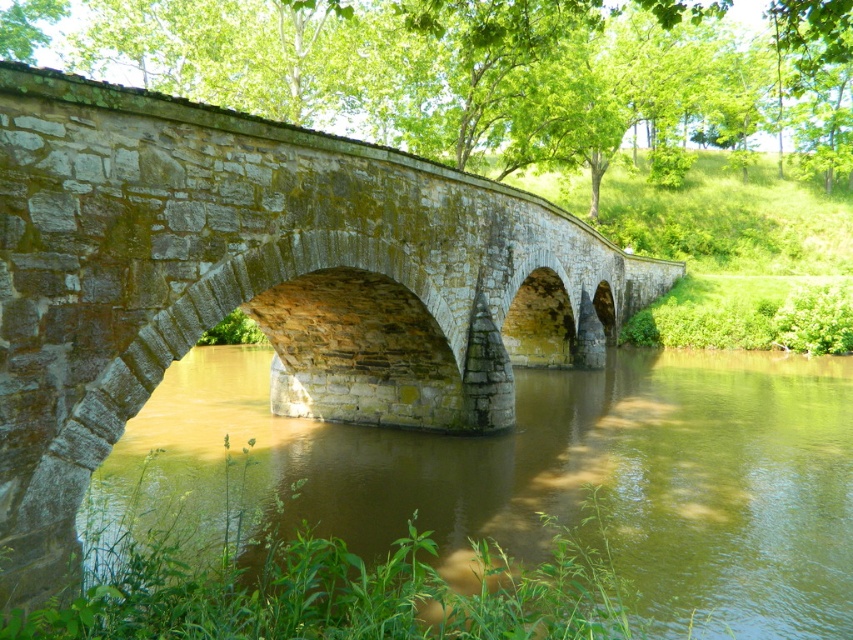
You are a boat operator who needs to navigate a 6.5 meter long boat under the gray stone bridge at center. The brown stone river at center is the path you must follow. Will your boat fit under the bridge without hitting it?

The gray stone bridge at center is 8.15 meters away from the brown stone river at center. Since the boat is 6.5 meters long, it will fit under the bridge as the distance between them is sufficient.

You are a boat captain navigating a small boat through the brown stone river at center. There is a gray stone bridge at center ahead. Can your boat pass under the bridge without hitting it?

The gray stone bridge at center is located above the brown stone river at center, so yes, the boat can pass under the bridge as it spans over the river.

You are standing at the origin point in the image. Which direction should you move to reach the gray stone bridge at center?

The gray stone bridge at center is located at coordinates 0.444 on the x axis and 0.305 on the y axis. Since you are at the origin point, you should move towards the right and slightly upwards to reach it.